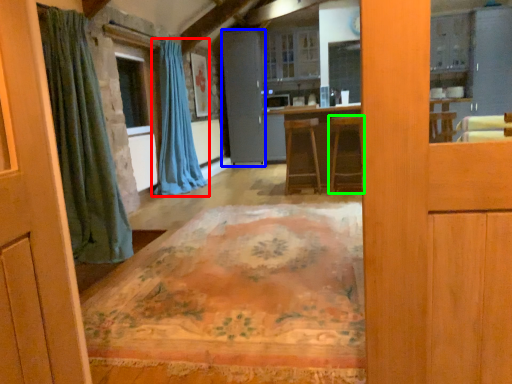
Question: Considering the real-world distances, which object is farthest from curtain (highlighted by a red box)? screen door (highlighted by a blue box) or furniture (highlighted by a green box)?

Choices:
 (A) screen door
 (B) furniture

Answer: (B)